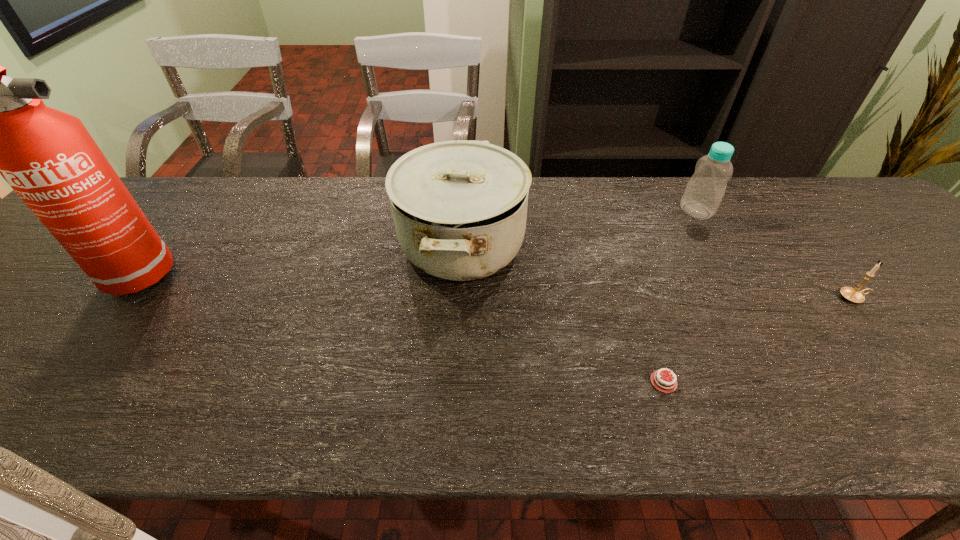
In order to click on the fourth closest object to the fourth object from left to right in this screenshot , I will do `click(0, 126)`.

Find the location of a particular element. object that stands as the second closest to the saucepan is located at coordinates (704, 192).

The image size is (960, 540). Find the location of `free location that satisfies the following two spatial constraints: 1. at the nozzle of the nearest object; 2. on the right side of the leftmost object`. free location that satisfies the following two spatial constraints: 1. at the nozzle of the nearest object; 2. on the right side of the leftmost object is located at coordinates (44, 382).

I want to click on vacant area that satisfies the following two spatial constraints: 1. on the back side of the bottle; 2. on the left side of the second object from left to right, so click(x=463, y=211).